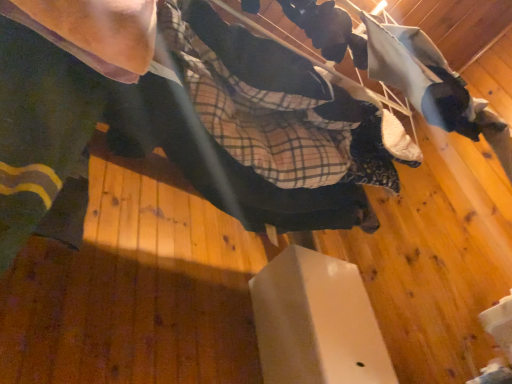
Where is `white matte box at center`? The image size is (512, 384). white matte box at center is located at coordinates (316, 322).

I want to click on fluffy white blanket at upper right, so click(x=327, y=29).

Find the location of a particular element. The width and height of the screenshot is (512, 384). white matte box at center is located at coordinates (316, 322).

Can we say matte black arm at upper left lies outside fluffy white blanket at upper right?

matte black arm at upper left is positioned outside fluffy white blanket at upper right.

How distant is matte black arm at upper left from fluffy white blanket at upper right?

They are 20.98 inches apart.

The height and width of the screenshot is (384, 512). What are the coordinates of `arm in front of the fluffy white blanket at upper right` in the screenshot? It's located at (96, 31).

From a real-world perspective, relative to fluffy white blanket at upper right, is matte black arm at upper left vertically above or below?

From a real-world perspective, matte black arm at upper left is physically below fluffy white blanket at upper right.

How much distance is there between white matte box at center and matte black arm at upper left?

The distance of white matte box at center from matte black arm at upper left is 1.00 meters.

Between white matte box at center and matte black arm at upper left, which one appears on the left side from the viewer's perspective?

matte black arm at upper left is more to the left.

Which object is closer to the camera taking this photo, white matte box at center or matte black arm at upper left?

matte black arm at upper left is more forward.

Which of these two, white matte box at center or matte black arm at upper left, is bigger?

Bigger between the two is white matte box at center.

Is fluffy white blanket at upper right bigger or smaller than matte black arm at upper left?

Considering their sizes, fluffy white blanket at upper right takes up more space than matte black arm at upper left.

From the picture: Which object is wider, fluffy white blanket at upper right or matte black arm at upper left?

fluffy white blanket at upper right is wider.

Which is in front, point (301, 17) or point (122, 42)?

The point (122, 42) is in front.

Considering the positions of objects fluffy white blanket at upper right and matte black arm at upper left in the image provided, who is behind, fluffy white blanket at upper right or matte black arm at upper left?

fluffy white blanket at upper right.

From the image's perspective, who appears lower, fluffy white blanket at upper right or white matte box at center?

white matte box at center is shown below in the image.

Considering the sizes of fluffy white blanket at upper right and white matte box at center in the image, is fluffy white blanket at upper right taller or shorter than white matte box at center?

Considering their sizes, fluffy white blanket at upper right has less height than white matte box at center.

Is point (332, 6) positioned before point (281, 312)?

That is True.

From the picture: How much distance is there between fluffy white blanket at upper right and white matte box at center?

fluffy white blanket at upper right and white matte box at center are 30.03 inches apart from each other.

Does matte black arm at upper left turn towards white matte box at center?

No, matte black arm at upper left is not facing towards white matte box at center.

Which object is wider, matte black arm at upper left or white matte box at center?

white matte box at center is wider.

Is point (48, 11) positioned in front of point (344, 325)?

Yes, point (48, 11) is in front of point (344, 325).

Can you tell me how much matte black arm at upper left and white matte box at center differ in facing direction?

The angular difference between matte black arm at upper left and white matte box at center is 0.00137 degrees.

Considering the relative positions of white matte box at center and fluffy white blanket at upper right in the image provided, is white matte box at center to the left of fluffy white blanket at upper right from the viewer's perspective?

Yes.

Is white matte box at center wider or thinner than fluffy white blanket at upper right?

In the image, white matte box at center appears to be wider than fluffy white blanket at upper right.

Which is behind, white matte box at center or fluffy white blanket at upper right?

Positioned behind is white matte box at center.

Is white matte box at center oriented towards fluffy white blanket at upper right?

Yes, white matte box at center is oriented towards fluffy white blanket at upper right.

From a real-world perspective, is matte black arm at upper left positioned over matte black skateboard at center based on gravity?

Yes.

From the image's perspective, is matte black arm at upper left below matte black skateboard at center?

No, from the image's perspective, matte black arm at upper left is not below matte black skateboard at center.

Considering the relative sizes of matte black arm at upper left and matte black skateboard at center in the image provided, is matte black arm at upper left taller than matte black skateboard at center?

Correct, matte black arm at upper left is much taller as matte black skateboard at center.

Is matte black arm at upper left further to the viewer compared to matte black skateboard at center?

No, it is not.

Identify the location of arm lying on the left of fluffy white blanket at upper right. This screenshot has width=512, height=384. (96, 31).

The image size is (512, 384). Find the location of `arm in front of the white matte box at center`. arm in front of the white matte box at center is located at coordinates (96, 31).

From the image, which object appears to be farther from matte black arm at upper left, matte black skateboard at center or white matte box at center?

Based on the image, white matte box at center appears to be further to matte black arm at upper left.

From the picture: When comparing their distances from matte black skateboard at center, does matte black arm at upper left or fluffy white blanket at upper right seem further?

fluffy white blanket at upper right is further to matte black skateboard at center.

Which object lies nearer to the anchor point fluffy white blanket at upper right, matte black skateboard at center or white matte box at center?

Based on the image, matte black skateboard at center appears to be nearer to fluffy white blanket at upper right.

Which object lies nearer to the anchor point white matte box at center, matte black arm at upper left or matte black skateboard at center?

The object closer to white matte box at center is matte black skateboard at center.

In the scene shown: When comparing their distances from matte black skateboard at center, does white matte box at center or matte black arm at upper left seem further?

white matte box at center.

Which object lies nearer to the anchor point fluffy white blanket at upper right, matte black arm at upper left or white matte box at center?

Among the two, matte black arm at upper left is located nearer to fluffy white blanket at upper right.

Estimate the real-world distances between objects in this image. Which object is closer to white matte box at center, matte black skateboard at center or fluffy white blanket at upper right?

matte black skateboard at center is closer to white matte box at center.

Based on their spatial positions, is matte black arm at upper left or fluffy white blanket at upper right closer to white matte box at center?

fluffy white blanket at upper right.

At what (x,y) coordinates should I click in order to perform the action: click on skateboarder between fluffy white blanket at upper right and white matte box at center in the vertical direction. Please return your answer as a coordinate pair (x, y). Looking at the image, I should click on (184, 115).

Find the location of `squat between matte black arm at upper left and white matte box at center from top to bottom`. squat between matte black arm at upper left and white matte box at center from top to bottom is located at coordinates (327, 29).

Where is `skateboarder between matte black arm at upper left and fluffy white blanket at upper right in the horizontal direction`? skateboarder between matte black arm at upper left and fluffy white blanket at upper right in the horizontal direction is located at coordinates click(x=184, y=115).

This screenshot has width=512, height=384. I want to click on skateboarder between matte black arm at upper left and white matte box at center in the up-down direction, so click(x=184, y=115).